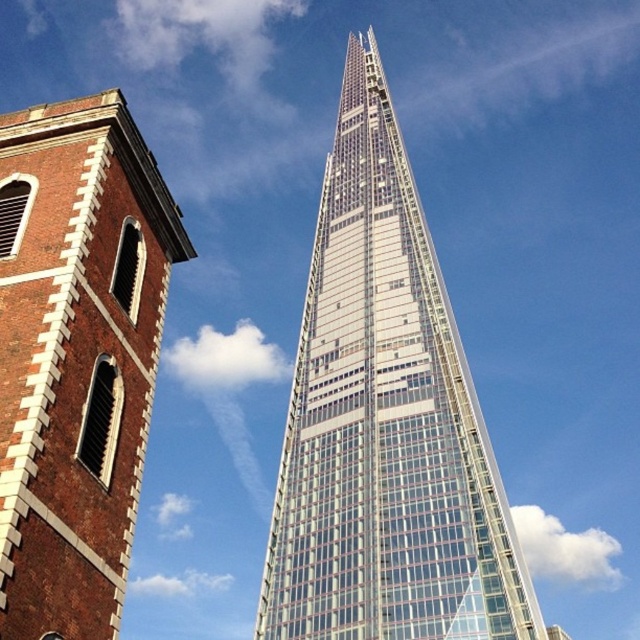
Question: Does transparent glass tower at center appear under brick tower at left?

Choices:
 (A) yes
 (B) no

Answer: (B)

Question: Is transparent glass tower at center wider than brick tower at left?

Choices:
 (A) no
 (B) yes

Answer: (B)

Question: Observing the image, what is the correct spatial positioning of transparent glass tower at center in reference to brick tower at left?

Choices:
 (A) right
 (B) left

Answer: (A)

Question: Which of the following is the farthest from the observer?

Choices:
 (A) transparent glass tower at center
 (B) brick tower at left

Answer: (A)

Question: Among these objects, which one is nearest to the camera?

Choices:
 (A) transparent glass tower at center
 (B) brick tower at left

Answer: (B)